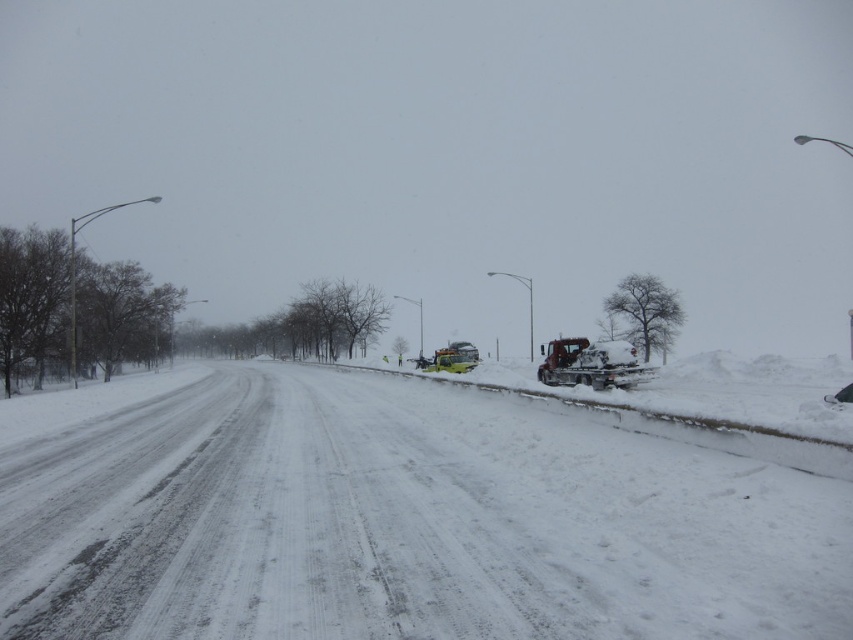
You are a snowplow operator who needs to clear the road. You see the white powdery snow at road center and the yellow metallic snowplow at center. Which object is larger?

The yellow metallic snowplow at center is larger than the white powdery snow at road center.